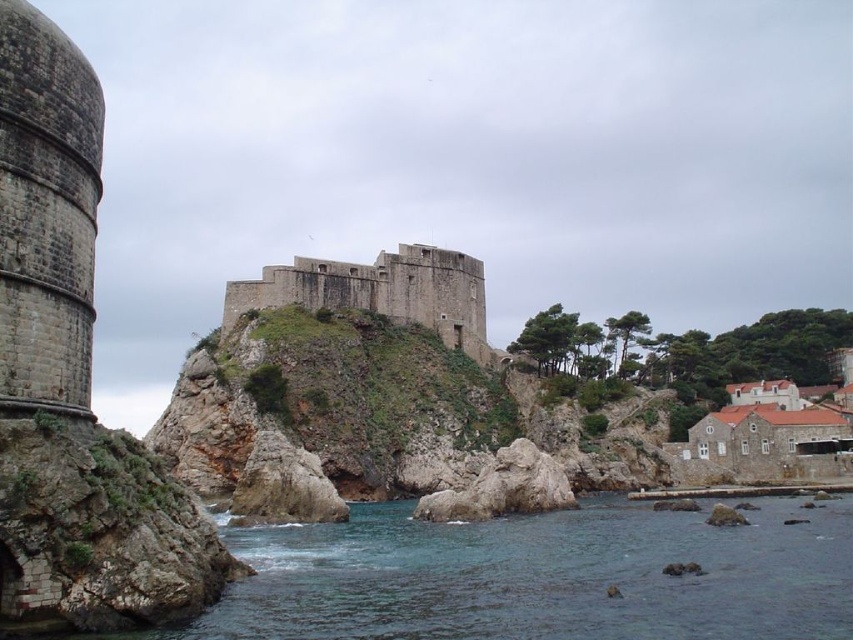
Between clear blue water at lower center and brown stone castle at center, which one has more height?

With more height is brown stone castle at center.

Who is more distant from viewer, (547, 525) or (460, 276)?

The point (460, 276) is behind.

Find the location of a particular element. The width and height of the screenshot is (853, 640). clear blue water at lower center is located at coordinates coord(541,577).